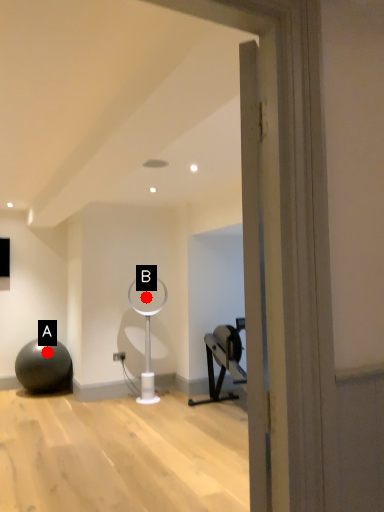
Question: Two points are circled on the image, labeled by A and B beside each circle. Which point appears closest to the camera in this image?

Choices:
 (A) A is closer
 (B) B is closer

Answer: (A)